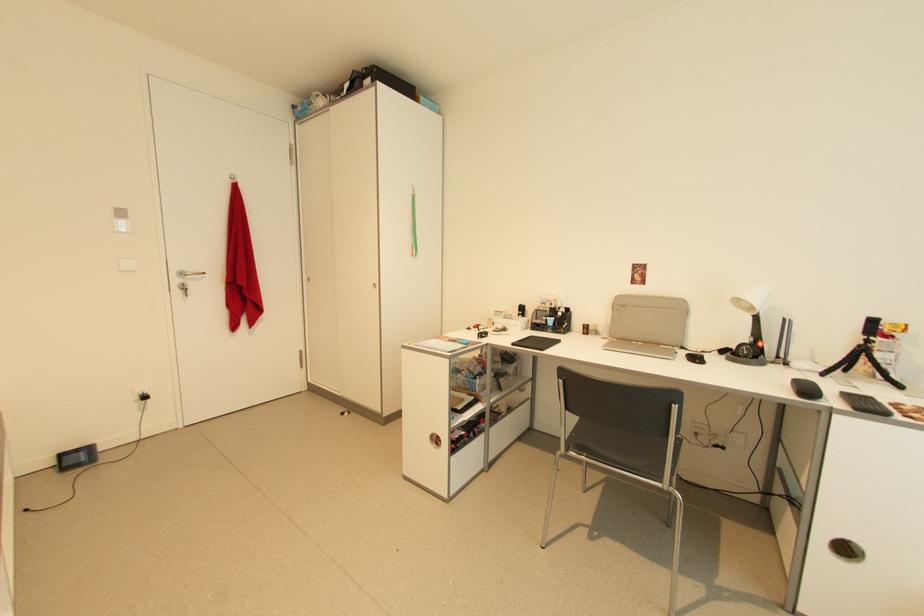
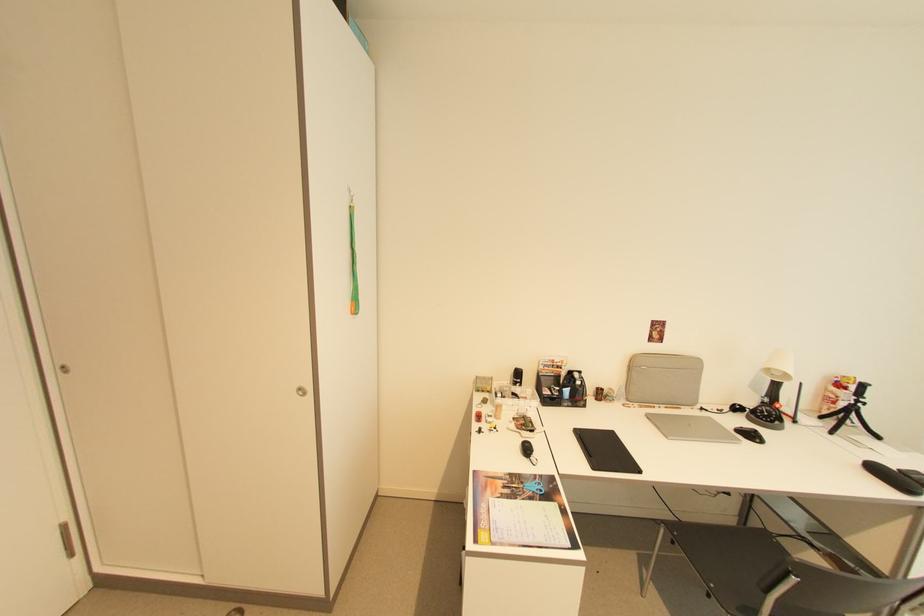
The point at (868,345) is marked in the first image. Where is the corresponding point in the second image?

(857, 405)